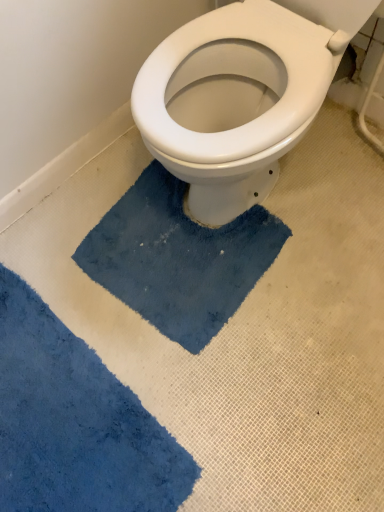
The height and width of the screenshot is (512, 384). What are the coordinates of `vacant region to the right of blue plush bath mat at center, which is the second bath mat in bottom-to-top order` in the screenshot? It's located at (324, 253).